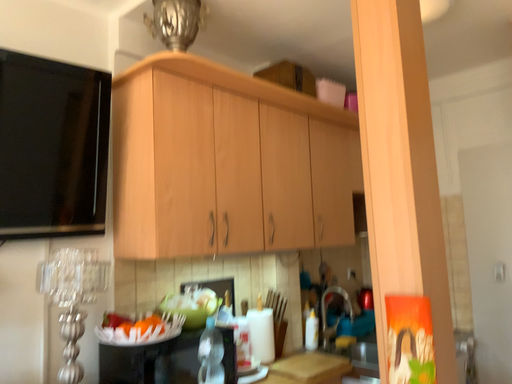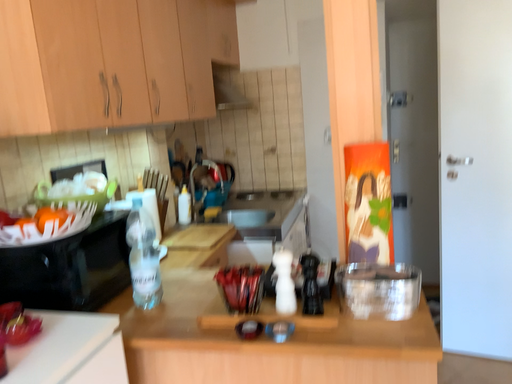
Question: Which way did the camera rotate in the video?

Choices:
 (A) rotated upward
 (B) rotated downward

Answer: (B)